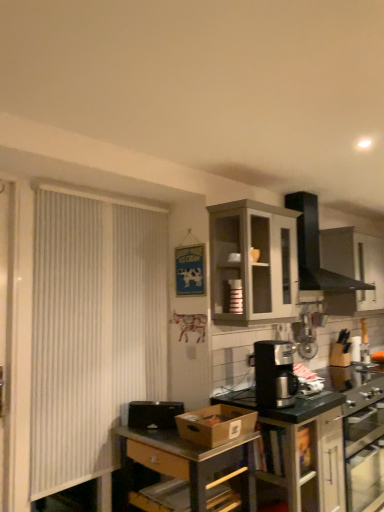
Measure the distance between white fabric curtain at left and camera.

A distance of 7.42 feet exists between white fabric curtain at left and camera.

The height and width of the screenshot is (512, 384). I want to click on white fabric curtain at left, so click(92, 330).

Identify the location of matte gray cabinet at upper center, the 1th cabinetry in the top-to-bottom sequence. Image resolution: width=384 pixels, height=512 pixels. (253, 261).

What is the approximate width of matte gray cabinet at upper center, the second cabinetry positioned from the bottom?

matte gray cabinet at upper center, the second cabinetry positioned from the bottom, is 14.09 inches wide.

The image size is (384, 512). What do you see at coordinates (327, 449) in the screenshot?
I see `matte black coffee maker at center, positioned as the first cabinetry in bottom-to-top order` at bounding box center [327, 449].

Describe the element at coordinates (315, 249) in the screenshot. I see `black matte vent at upper center` at that location.

This screenshot has width=384, height=512. Identify the location of metallic gray table at center. (190, 461).

Image resolution: width=384 pixels, height=512 pixels. What are the coordinates of `white fabric curtain at left` in the screenshot? It's located at (92, 330).

Is black plastic coffee maker at center in contact with matte black coffee maker at center, which is the second cabinetry in top-to-bottom order?

No, black plastic coffee maker at center is not in contact with matte black coffee maker at center, which is the second cabinetry in top-to-bottom order.

Can matte black coffee maker at center, which is the second cabinetry in top-to-bottom order, be found inside black plastic coffee maker at center?

No, matte black coffee maker at center, which is the second cabinetry in top-to-bottom order, is located outside of black plastic coffee maker at center.

From the picture: Which object is closer to the camera taking this photo, black plastic coffee maker at center or matte black coffee maker at center, positioned as the first cabinetry in bottom-to-top order?

matte black coffee maker at center, positioned as the first cabinetry in bottom-to-top order, is more forward.

Is matte gray cabinet at upper center, the 1th cabinetry in the top-to-bottom sequence, taller than white textured screen door at left?

No, matte gray cabinet at upper center, the 1th cabinetry in the top-to-bottom sequence, is not taller than white textured screen door at left.

Does matte gray cabinet at upper center, the 1th cabinetry in the top-to-bottom sequence, have a larger size compared to white textured screen door at left?

Yes.

Are matte gray cabinet at upper center, the second cabinetry positioned from the bottom, and white textured screen door at left far apart?

That's right, there is a large distance between matte gray cabinet at upper center, the second cabinetry positioned from the bottom, and white textured screen door at left.

In the scene shown: Which is nearer, (233, 215) or (7, 220)?

Clearly, point (233, 215) is more distant from the camera than point (7, 220).

Is there a large distance between white textured screen door at left and black plastic coffee maker at center?

Absolutely, white textured screen door at left is distant from black plastic coffee maker at center.

Can you confirm if white textured screen door at left is wider than black plastic coffee maker at center?

No.

From a real-world perspective, which object stands above the other?

From a 3D spatial view, white textured screen door at left is above.

Is white textured screen door at left positioned with its back to black plastic coffee maker at center?

white textured screen door at left does not have its back to black plastic coffee maker at center.

Is black matte vent at upper center in contact with black plastic coffee maker at lower right?

No, black matte vent at upper center is not beside black plastic coffee maker at lower right.

Between black matte vent at upper center and black plastic coffee maker at lower right, which one has larger size?

With larger size is black matte vent at upper center.

Looking at their sizes, would you say black matte vent at upper center is wider or thinner than black plastic coffee maker at lower right?

In the image, black matte vent at upper center appears to be more narrow than black plastic coffee maker at lower right.

From a real-world perspective, is black matte vent at upper center positioned under black plastic coffee maker at lower right based on gravity?

Actually, black matte vent at upper center is physically above black plastic coffee maker at lower right in the real world.

Based on the photo, is white fabric curtain at left looking in the opposite direction of matte gray cabinet at upper center, the second cabinetry positioned from the bottom?

white fabric curtain at left is not turned away from matte gray cabinet at upper center, the second cabinetry positioned from the bottom.

Can you confirm if white fabric curtain at left is positioned to the right of matte gray cabinet at upper center, the 1th cabinetry in the top-to-bottom sequence?

In fact, white fabric curtain at left is to the left of matte gray cabinet at upper center, the 1th cabinetry in the top-to-bottom sequence.

Who is taller, white fabric curtain at left or matte gray cabinet at upper center, the 1th cabinetry in the top-to-bottom sequence?

With more height is white fabric curtain at left.

Which is farther, (x=91, y=440) or (x=355, y=370)?

The point (x=355, y=370) is farther.

From the image's perspective, which object appears higher, white fabric curtain at left or black plastic coffee maker at lower right?

white fabric curtain at left is shown above in the image.

Is white fabric curtain at left looking in the opposite direction of black plastic coffee maker at lower right?

white fabric curtain at left does not have its back to black plastic coffee maker at lower right.

Considering the relative positions of white fabric curtain at left and black plastic coffee maker at lower right in the image provided, is white fabric curtain at left to the left or to the right of black plastic coffee maker at lower right?

Based on their positions, white fabric curtain at left is located to the left of black plastic coffee maker at lower right.

Is matte black coffee maker at center, positioned as the first cabinetry in bottom-to-top order, positioned with its back to black matte vent at upper center?

No.

Based on the photo, can black matte vent at upper center be found inside matte black coffee maker at center, which is the second cabinetry in top-to-bottom order?

No, black matte vent at upper center is not surrounded by matte black coffee maker at center, which is the second cabinetry in top-to-bottom order.

Considering the positions of point (323, 473) and point (356, 288), is point (323, 473) closer or farther from the camera than point (356, 288)?

Point (323, 473) appears to be closer to the viewer than point (356, 288).

Image resolution: width=384 pixels, height=512 pixels. I want to click on home appliance behind the matte black coffee maker at center, positioned as the first cabinetry in bottom-to-top order, so click(x=315, y=249).

Where is `cabinetry lying below the black plastic coffee maker at center (from the image's perspective)`? cabinetry lying below the black plastic coffee maker at center (from the image's perspective) is located at coordinates (327, 449).

This screenshot has width=384, height=512. Find the location of `the 1st cabinetry to the right of the white textured screen door at left, starting your count from the anchor`. the 1st cabinetry to the right of the white textured screen door at left, starting your count from the anchor is located at coordinates (253, 261).

From the image, which object appears to be nearer to matte gray cabinet at upper center, the 1th cabinetry in the top-to-bottom sequence, black plastic coffee maker at center or black plastic coffee maker at lower right?

Based on the image, black plastic coffee maker at center appears to be nearer to matte gray cabinet at upper center, the 1th cabinetry in the top-to-bottom sequence.

Based on their spatial positions, is white fabric curtain at left or matte gray cabinet at upper center, the 1th cabinetry in the top-to-bottom sequence, closer to metallic gray table at center?

white fabric curtain at left is positioned closer to the anchor metallic gray table at center.

Estimate the real-world distances between objects in this image. Which object is closer to black plastic coffee maker at lower right, matte black coffee maker at center, positioned as the first cabinetry in bottom-to-top order, or white textured screen door at left?

matte black coffee maker at center, positioned as the first cabinetry in bottom-to-top order, lies closer to black plastic coffee maker at lower right than the other object.

Looking at the image, which one is located further to matte black coffee maker at center, positioned as the first cabinetry in bottom-to-top order, black matte vent at upper center or white textured screen door at left?

white textured screen door at left is positioned further to the anchor matte black coffee maker at center, positioned as the first cabinetry in bottom-to-top order.

From the image, which object appears to be nearer to white textured screen door at left, matte black coffee maker at center, positioned as the first cabinetry in bottom-to-top order, or white fabric curtain at left?

white fabric curtain at left is positioned closer to the anchor white textured screen door at left.

From the image, which object appears to be farther from black matte vent at upper center, matte black coffee maker at center, positioned as the first cabinetry in bottom-to-top order, or black plastic coffee maker at lower right?

black plastic coffee maker at lower right lies further to black matte vent at upper center than the other object.

Estimate the real-world distances between objects in this image. Which object is further from black plastic bowl at center, white fabric curtain at left or black plastic coffee maker at lower right?

black plastic coffee maker at lower right lies further to black plastic bowl at center than the other object.

Considering their positions, is black plastic coffee maker at lower right positioned further to white fabric curtain at left than black plastic coffee maker at center?

black plastic coffee maker at lower right is further to white fabric curtain at left.

Identify the location of cabinetry between white fabric curtain at left and black plastic coffee maker at center in the horizontal direction. This screenshot has width=384, height=512. (253, 261).

This screenshot has width=384, height=512. Identify the location of cabinetry that lies between black matte vent at upper center and black plastic coffee maker at center from top to bottom. (253, 261).

Where is `curtain between white textured screen door at left and matte gray cabinet at upper center, the 1th cabinetry in the top-to-bottom sequence, from left to right`? Image resolution: width=384 pixels, height=512 pixels. curtain between white textured screen door at left and matte gray cabinet at upper center, the 1th cabinetry in the top-to-bottom sequence, from left to right is located at coordinates (92, 330).

The height and width of the screenshot is (512, 384). Find the location of `table between white fabric curtain at left and black plastic coffee maker at center in the horizontal direction`. table between white fabric curtain at left and black plastic coffee maker at center in the horizontal direction is located at coordinates (190, 461).